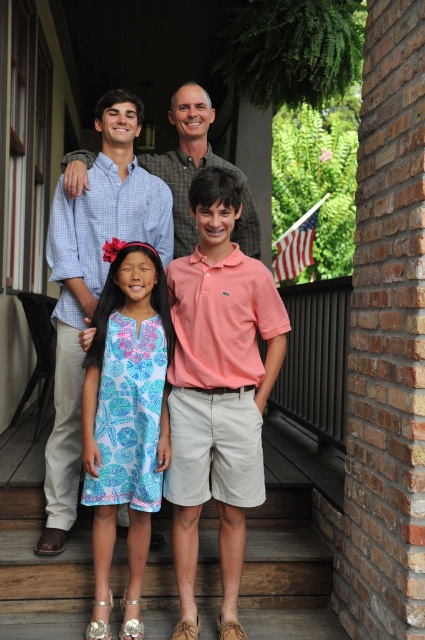
Is linen dress at center further to the viewer compared to matte plaid shirt at upper center?

That is False.

Does linen dress at center come in front of matte plaid shirt at upper center?

Yes, it is in front of matte plaid shirt at upper center.

Is point (119, 387) positioned in front of point (251, 204)?

Yes.

The image size is (425, 640). Identify the location of linen dress at center. (125, 419).

This screenshot has width=425, height=640. Describe the element at coordinates (93, 284) in the screenshot. I see `brushed metal shirt at upper center` at that location.

Between brushed metal shirt at upper center and blue floral dress at center, which one has less height?

blue floral dress at center

Which is in front, point (129, 100) or point (240, 532)?

Point (240, 532) is more forward.

Find the location of a particular element. Image resolution: width=425 pixels, height=640 pixels. brushed metal shirt at upper center is located at coordinates (93, 284).

Is point (133, 621) positioned behind point (209, 106)?

No, (133, 621) is closer to viewer.

Which is above, linen dress at center or blue floral dress at center?

blue floral dress at center is above.

You are a GUI agent. You are given a task and a screenshot of the screen. Output one action in this format:
    pyautogui.click(x=<x>, y=<y>)
    Task: Click on the linen dress at center
    The height and width of the screenshot is (640, 425).
    Given the screenshot: What is the action you would take?
    pyautogui.click(x=125, y=419)